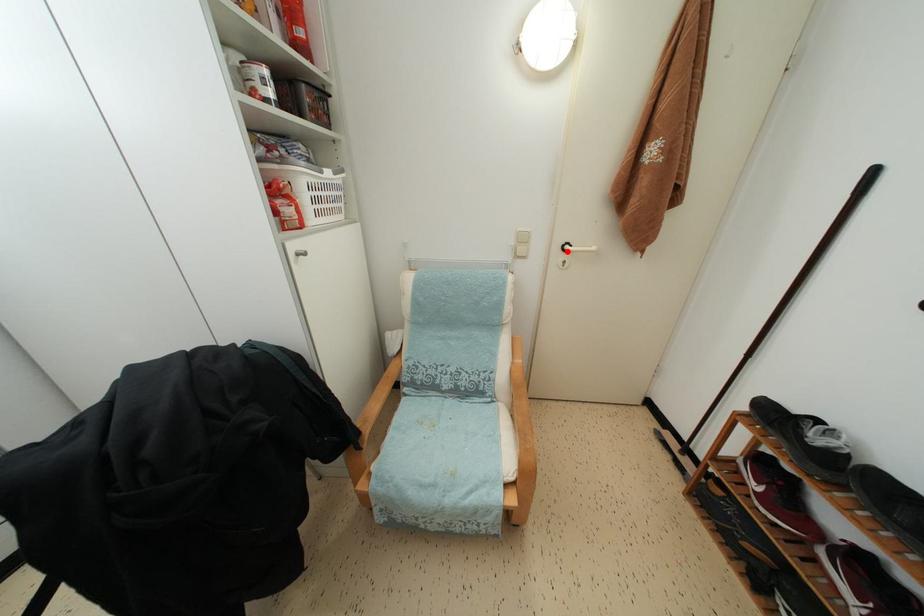
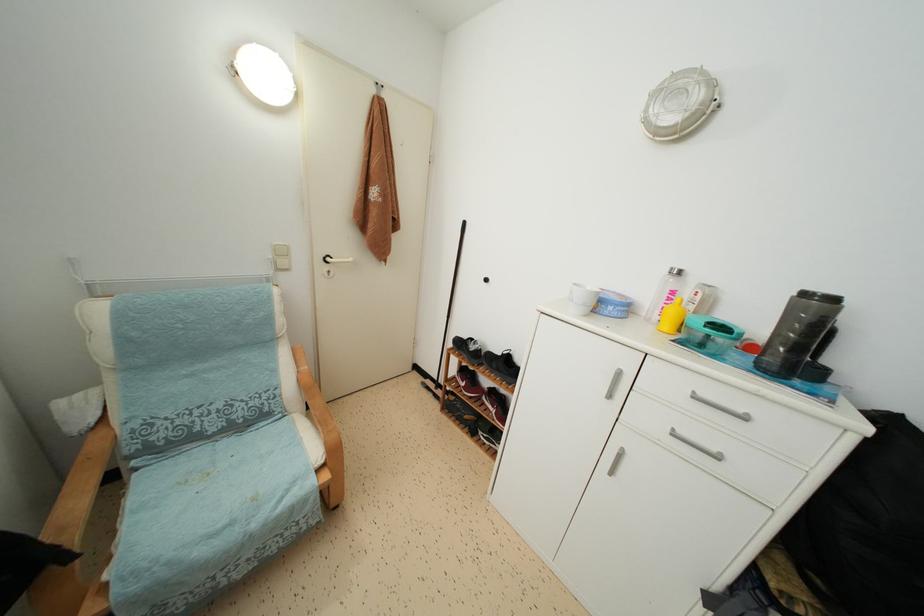
The point at the highlighted location is marked in the first image. Where is the corresponding point in the second image?

(329, 264)